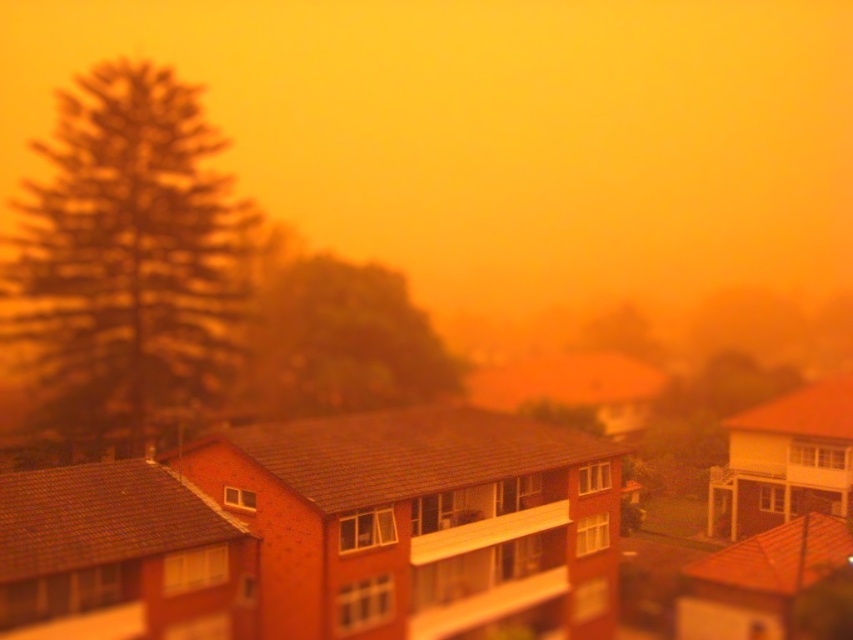
Question: Which point is farther to the camera?

Choices:
 (A) (387, 316)
 (B) (132, 74)

Answer: (A)

Question: Which of the following is the closest to the observer?

Choices:
 (A) (422, 368)
 (B) (189, 296)

Answer: (B)

Question: Does green textured tree at left appear on the left side of green leafy tree at center?

Choices:
 (A) no
 (B) yes

Answer: (B)

Question: Does green textured tree at left come in front of green leafy tree at center?

Choices:
 (A) yes
 (B) no

Answer: (A)

Question: Is green textured tree at left wider than green leafy tree at center?

Choices:
 (A) no
 (B) yes

Answer: (B)